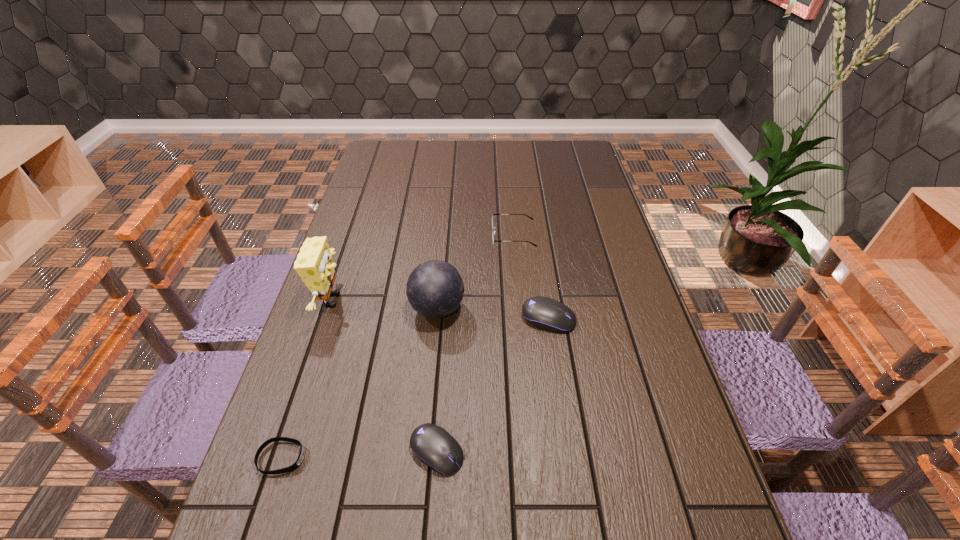
In the current image, all computer mouses are evenly spaced. To maintain this equal spacing, where should an additional computer mouse be placed on the right? Please point out a free spot. Please provide its 2D coordinates. Your answer should be formatted as a tuple, i.e. [(x, y)], where the tuple contains the x and y coordinates of a point satisfying the conditions above.

[(619, 234)]